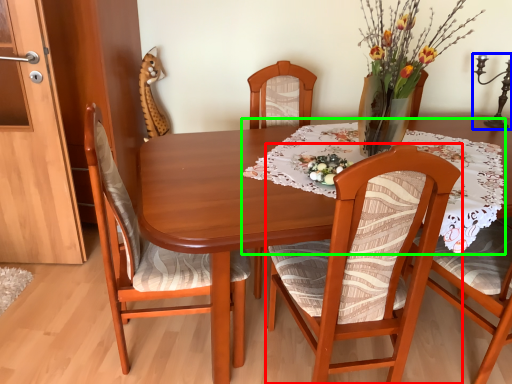
Question: Considering the real-world distances, which object is farthest from chair (highlighted by a red box)? candle holder (highlighted by a blue box) or tablecloth (highlighted by a green box)?

Choices:
 (A) candle holder
 (B) tablecloth

Answer: (A)